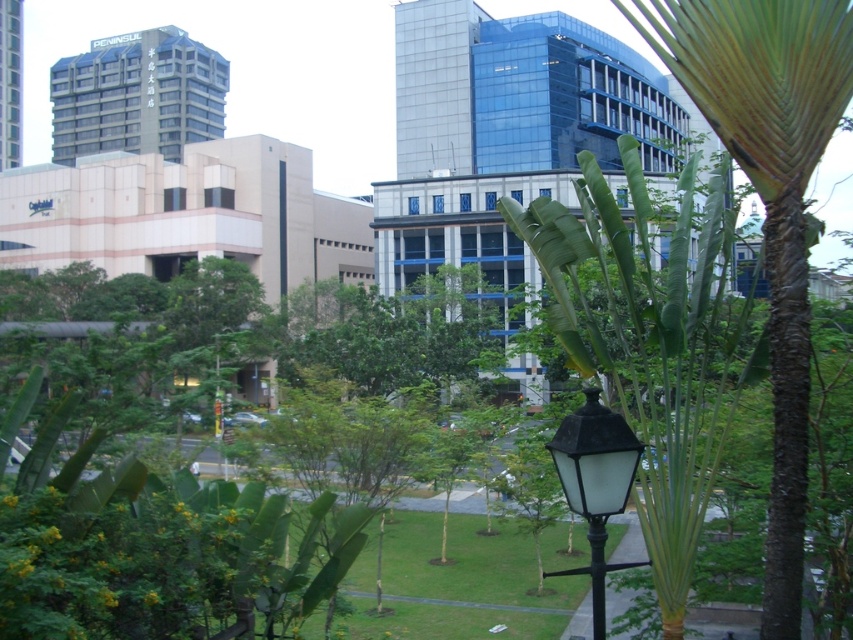
Question: Can you confirm if green leafy palm tree at center is positioned to the right of green leafy palm at center?

Choices:
 (A) no
 (B) yes

Answer: (B)

Question: Among these points, which one is nearest to the camera?

Choices:
 (A) click(663, 451)
 (B) click(816, 131)

Answer: (B)

Question: Does green leafy palm tree at center come in front of green leafy palm at center?

Choices:
 (A) no
 (B) yes

Answer: (A)

Question: Is green leafy palm tree at center to the left of green leafy palm at center from the viewer's perspective?

Choices:
 (A) yes
 (B) no

Answer: (B)

Question: Which is farther from the green leafy palm tree at center?

Choices:
 (A) black glass street light at center
 (B) green leafy palm at center

Answer: (A)

Question: Which object is the closest to the green leafy palm tree at center?

Choices:
 (A) black glass street light at center
 (B) green leafy palm at center

Answer: (B)